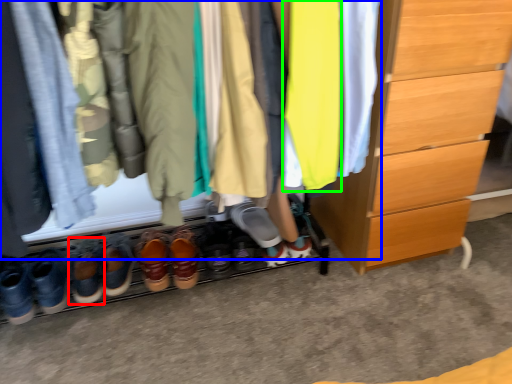
Question: Estimate the real-world distances between objects in this image. Which object is farther from footwear (highlighted by a red box), closet (highlighted by a blue box) or clothing (highlighted by a green box)?

Choices:
 (A) closet
 (B) clothing

Answer: (B)